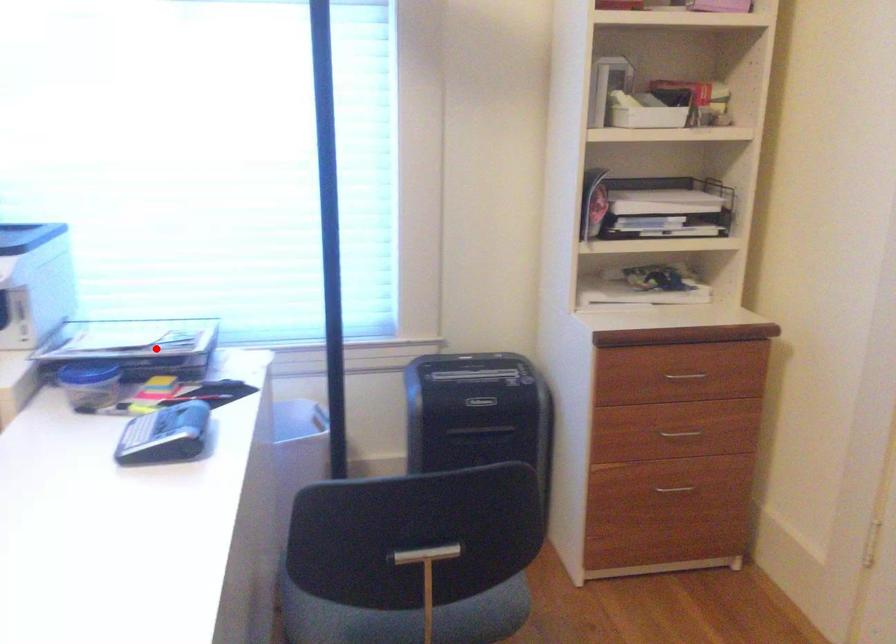
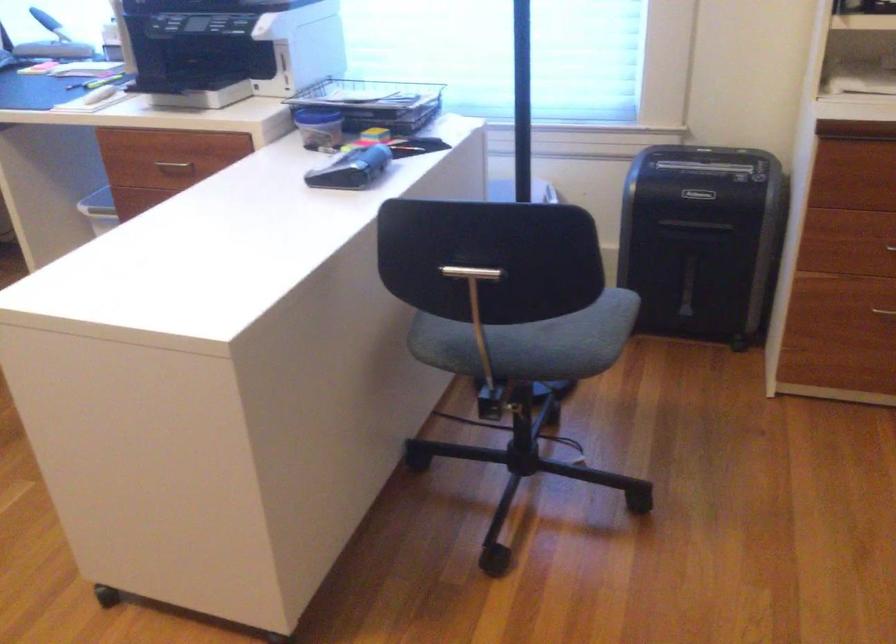
The point at the highlighted location is marked in the first image. Where is the corresponding point in the second image?

(374, 102)